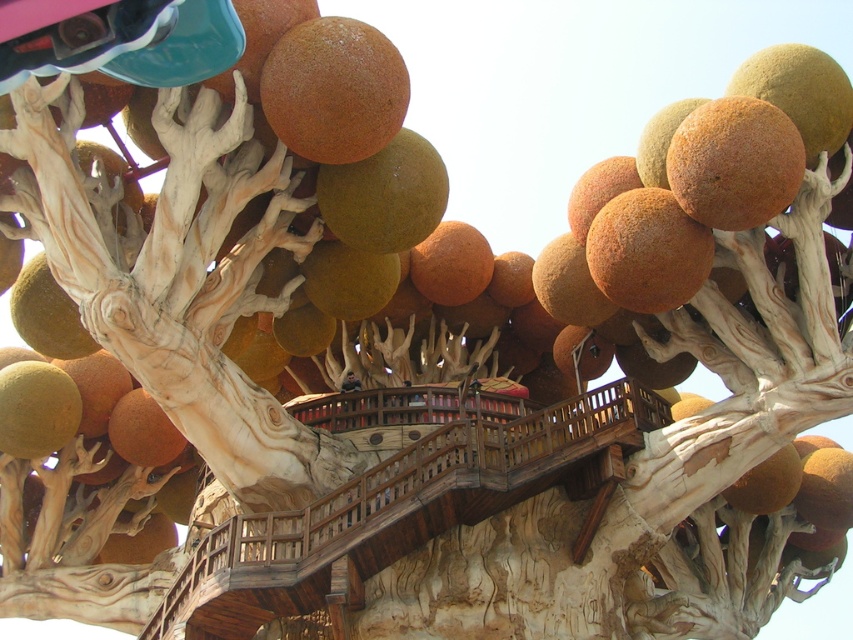
Question: Estimate the real-world distances between objects in this image. Which object is farther from the wooden at center?

Choices:
 (A) brown rough sphere at upper right
 (B) green matte fruit at lower left

Answer: (B)

Question: Which point is farther to the camera?

Choices:
 (A) (277, 84)
 (B) (44, 369)
 (C) (672, 220)
 (D) (439, 467)

Answer: (B)

Question: Is wooden at center below green matte fruit at lower left?

Choices:
 (A) yes
 (B) no

Answer: (A)

Question: Which of these objects is positioned farthest from the brown matte sphere at center?

Choices:
 (A) rustic textured sphere at upper center
 (B) green matte fruit at lower left
 (C) wooden at center

Answer: (B)

Question: Does brown matte sphere at center have a smaller size compared to green matte fruit at lower left?

Choices:
 (A) yes
 (B) no

Answer: (B)

Question: Can you confirm if brown matte sphere at center is wider than green matte fruit at lower left?

Choices:
 (A) yes
 (B) no

Answer: (A)